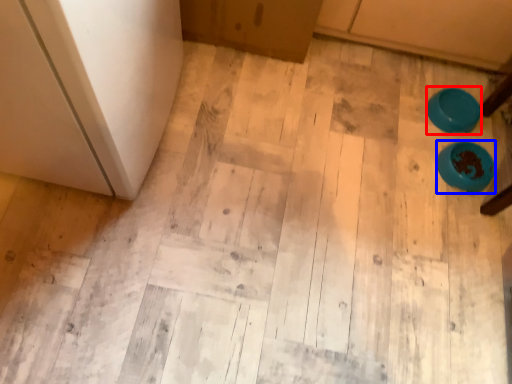
Question: Among these objects, which one is nearest to the camera, bowl (highlighted by a red box) or bowl (highlighted by a blue box)?

Choices:
 (A) bowl
 (B) bowl

Answer: (B)